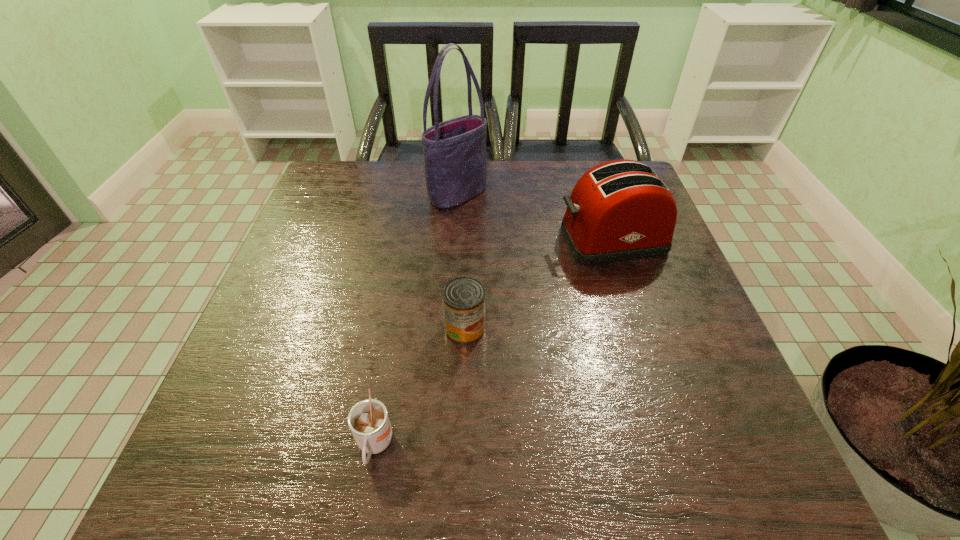
This screenshot has width=960, height=540. I want to click on object that is positioned at the far edge, so click(455, 158).

You are a GUI agent. You are given a task and a screenshot of the screen. Output one action in this format:
    pyautogui.click(x=<x>, y=<y>)
    Task: Click on the object that is positioned at the near edge
    
    Given the screenshot: What is the action you would take?
    pyautogui.click(x=368, y=420)

In order to click on object at the right edge in this screenshot , I will do `click(620, 210)`.

You are a GUI agent. You are given a task and a screenshot of the screen. Output one action in this format:
    pyautogui.click(x=<x>, y=<y>)
    Task: Click on the free space at the far edge of the desktop
    This screenshot has width=960, height=540.
    Given the screenshot: What is the action you would take?
    pyautogui.click(x=424, y=177)

The height and width of the screenshot is (540, 960). Find the location of `vacant space at the left edge of the desktop`. vacant space at the left edge of the desktop is located at coordinates (235, 406).

Locate an element on the screen. free location at the right edge of the desktop is located at coordinates (670, 261).

This screenshot has width=960, height=540. In the image, there is a desktop. Find the location of `vacant space at the near left corner`. vacant space at the near left corner is located at coordinates (180, 489).

In the image, there is a desktop. Identify the location of vacant space at the near right corner. This screenshot has height=540, width=960. (672, 464).

The width and height of the screenshot is (960, 540). I want to click on free space between the cup and the tote bag, so click(417, 320).

Where is `unoccupied position between the can and the leftmost object`? The height and width of the screenshot is (540, 960). unoccupied position between the can and the leftmost object is located at coordinates (420, 387).